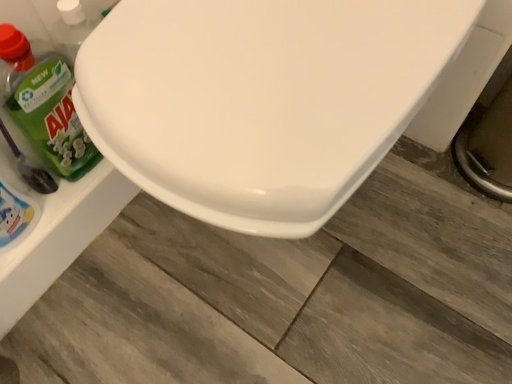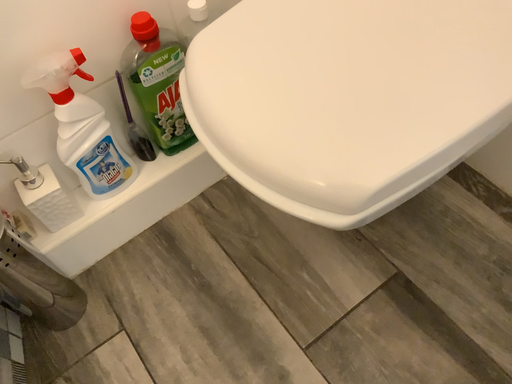
Question: How did the camera likely rotate when shooting the video?

Choices:
 (A) rotated right
 (B) rotated left

Answer: (B)